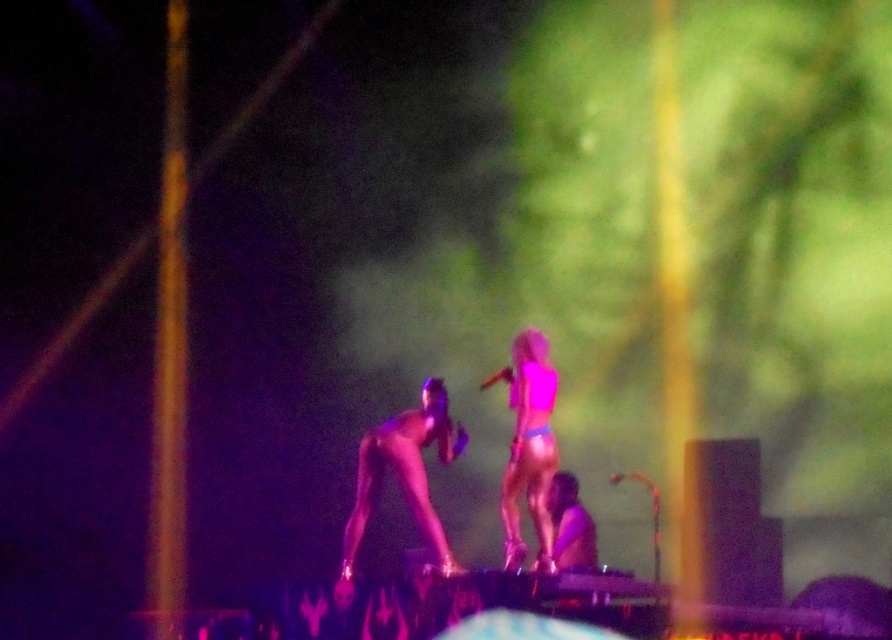
Question: Which object is farther from the camera taking this photo?

Choices:
 (A) shiny metallic pole at center
 (B) pink matte bikini at center

Answer: (B)

Question: Where is shiny metallic pole at center located in relation to pink matte bikini at center in the image?

Choices:
 (A) left
 (B) right

Answer: (A)

Question: Can you confirm if shiny metallic pole at center is positioned above pink matte bikini at center?

Choices:
 (A) yes
 (B) no

Answer: (B)

Question: Among these points, which one is farthest from the camera?

Choices:
 (A) (380, 428)
 (B) (517, 435)

Answer: (A)

Question: Is shiny metallic pole at center positioned in front of pink matte bikini at center?

Choices:
 (A) no
 (B) yes

Answer: (B)